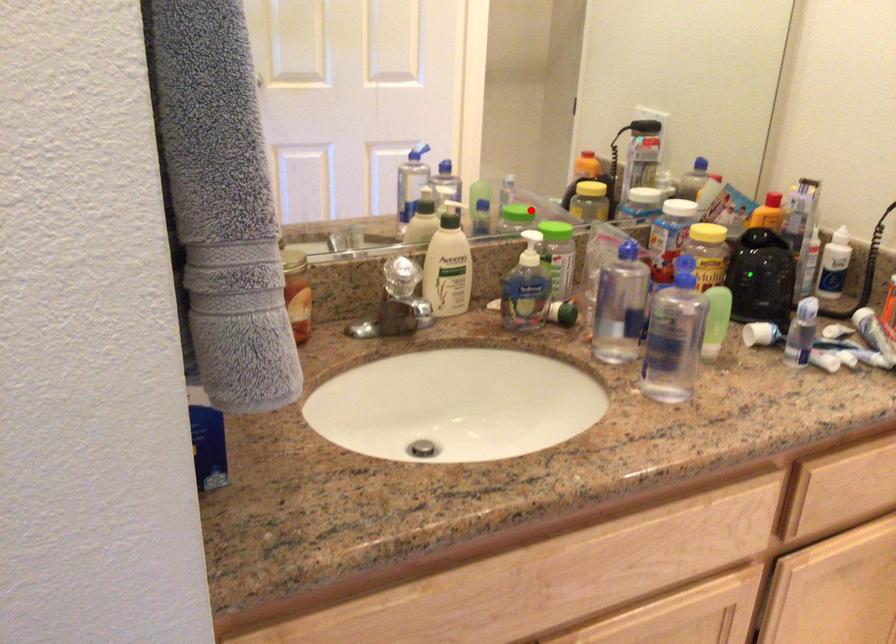
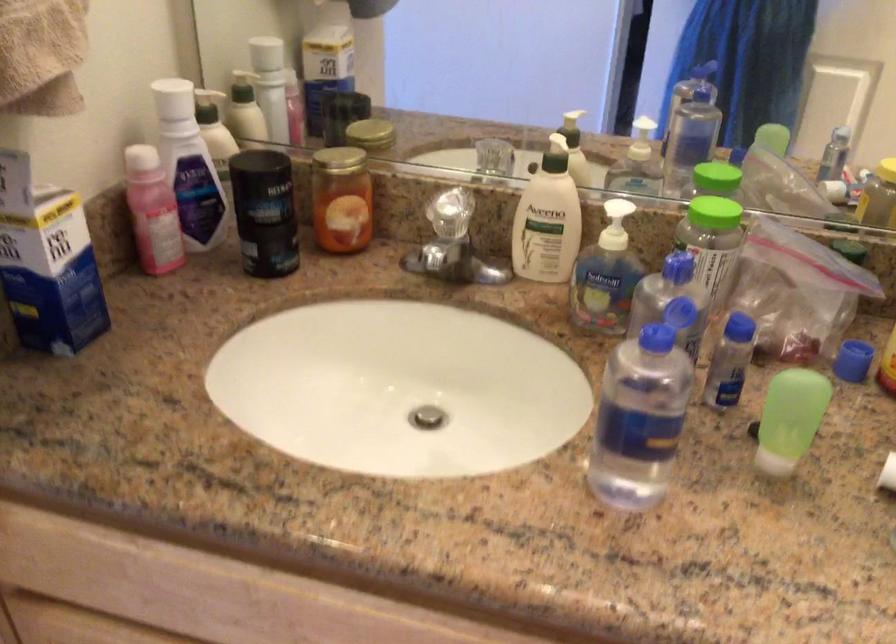
Question: I am providing you with two images of the same scene from different viewpoints. A red point is shown in image1. For the corresponding object point in image2, is it positioned nearer or farther from the camera?

Choices:
 (A) Nearer
 (B) Farther

Answer: (A)